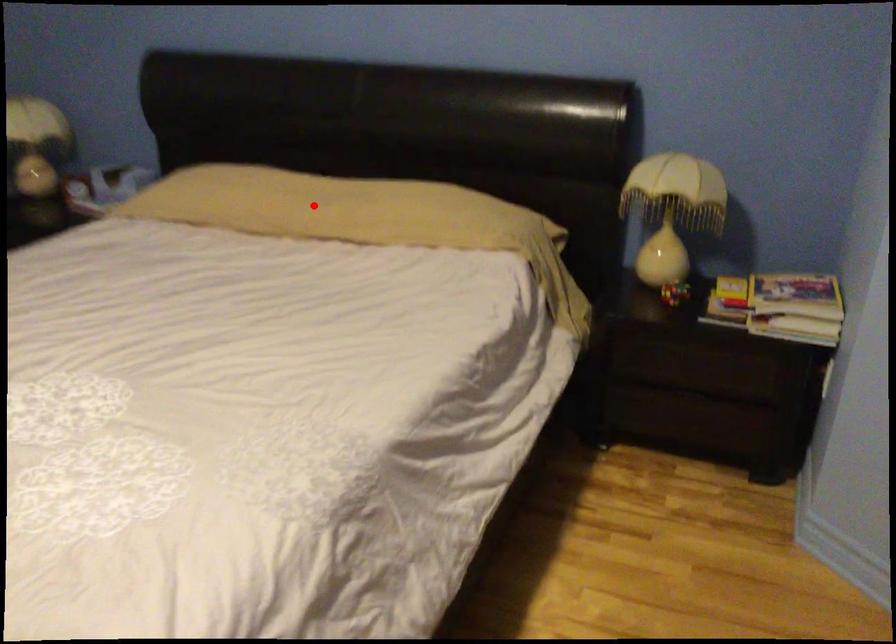
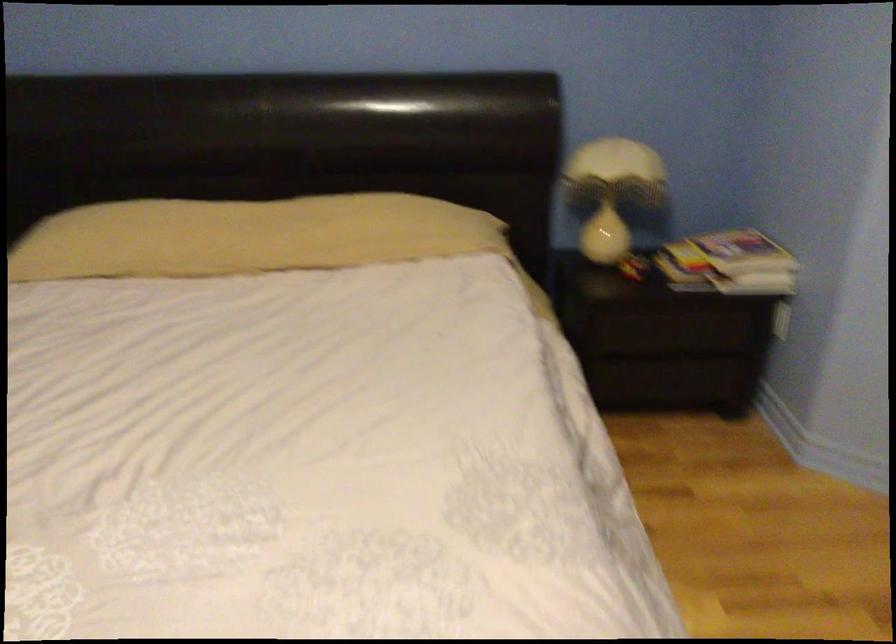
The point at the highlighted location is marked in the first image. Where is the corresponding point in the second image?

(247, 236)